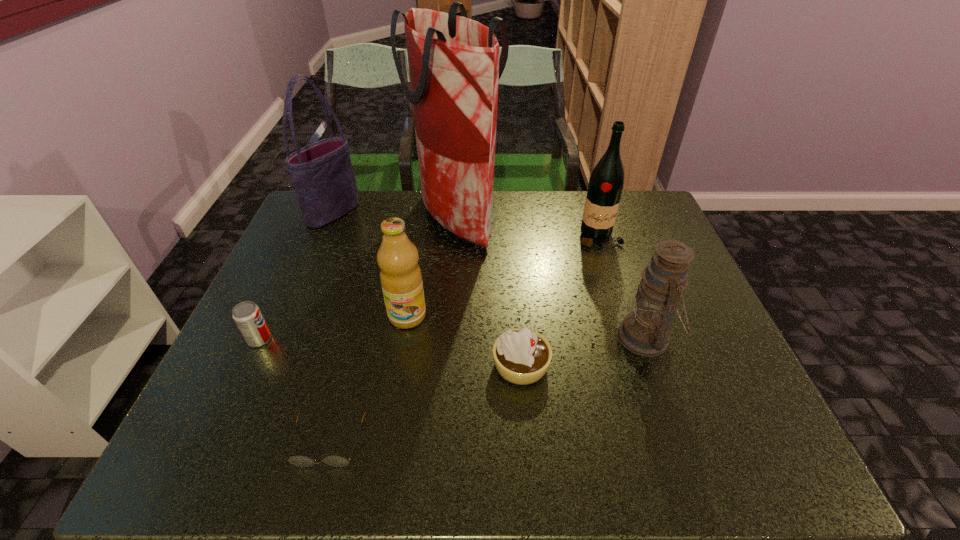
At what (x,y) coordinates should I click in order to perform the action: click on vacant space situated 0.310m on the front of the tote bag. Please return your answer as a coordinate pair (x, y). The width and height of the screenshot is (960, 540). Looking at the image, I should click on (297, 299).

Where is `vacant region located on the surface of the sixth shortest object`? The image size is (960, 540). vacant region located on the surface of the sixth shortest object is located at coordinates (637, 358).

I want to click on vacant space situated on the label of the olive oil, so click(x=395, y=397).

This screenshot has width=960, height=540. What are the coordinates of `vacant region located 0.390m on the back of the oil lamp` in the screenshot? It's located at (605, 221).

The image size is (960, 540). Find the location of `blank area located on the front of the soda`. blank area located on the front of the soda is located at coordinates (206, 455).

Image resolution: width=960 pixels, height=540 pixels. Find the location of `vacant space located 0.320m on the right of the whipped cream`. vacant space located 0.320m on the right of the whipped cream is located at coordinates (688, 366).

You are a GUI agent. You are given a task and a screenshot of the screen. Output one action in this format:
    pyautogui.click(x=<x>, y=<y>)
    Task: Click on the grocery bag that is at the far edge
    This screenshot has width=960, height=540.
    Given the screenshot: What is the action you would take?
    pyautogui.click(x=454, y=66)

Locate an element on the screen. This screenshot has width=960, height=540. tote bag that is at the far edge is located at coordinates (322, 174).

What are the coordinates of `wine bottle present at the far edge` in the screenshot? It's located at (605, 187).

You are a GUI agent. You are given a task and a screenshot of the screen. Output one action in this format:
    pyautogui.click(x=<x>, y=<y>)
    Task: Click on the object present at the near edge
    Image resolution: width=960 pixels, height=540 pixels.
    Given the screenshot: What is the action you would take?
    pyautogui.click(x=337, y=461)